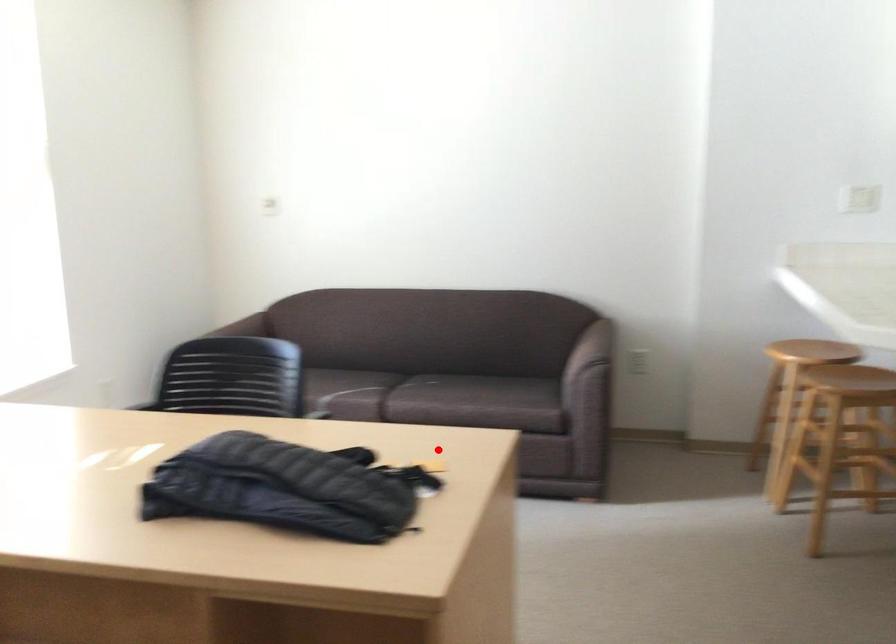
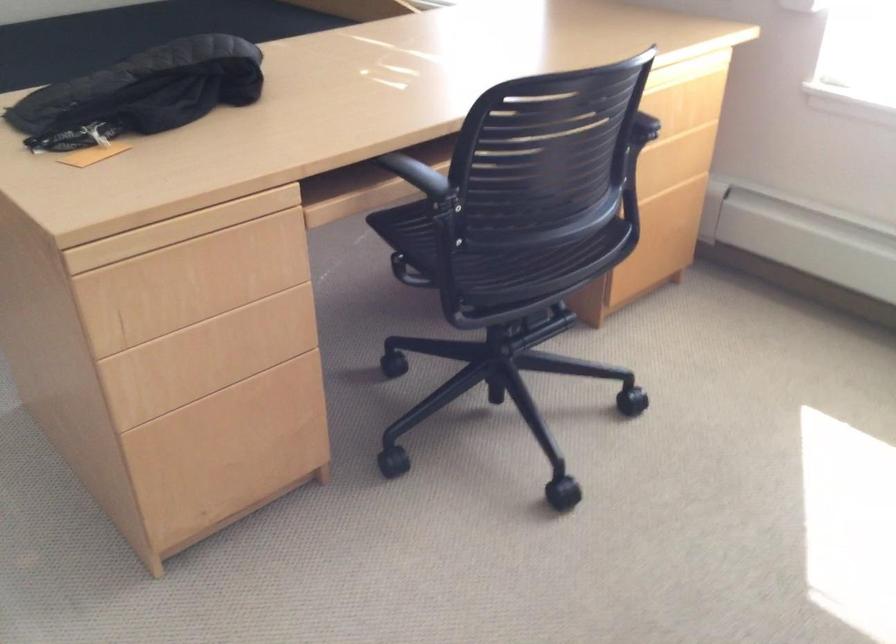
Find the pixel in the second image that matches the highlighted location in the first image.

(179, 229)